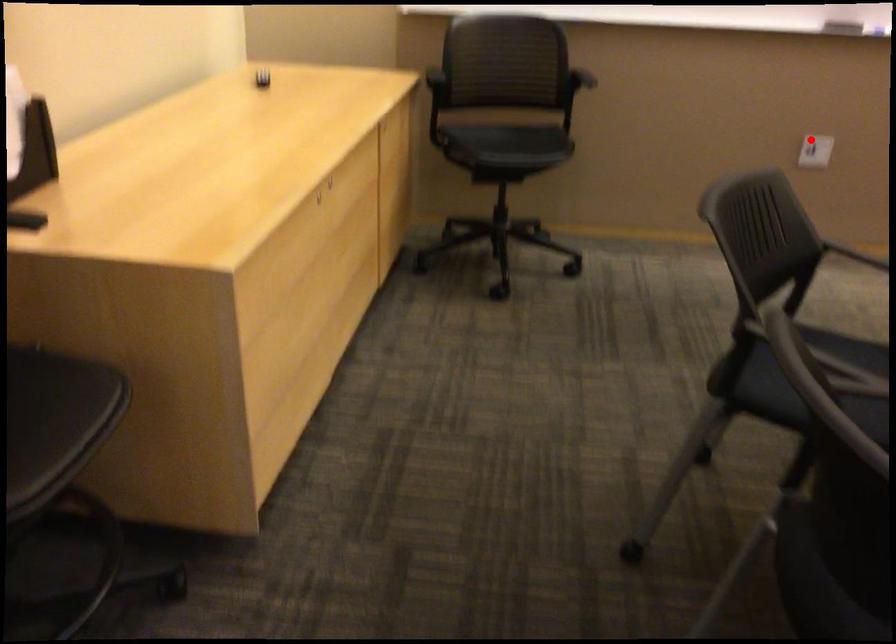
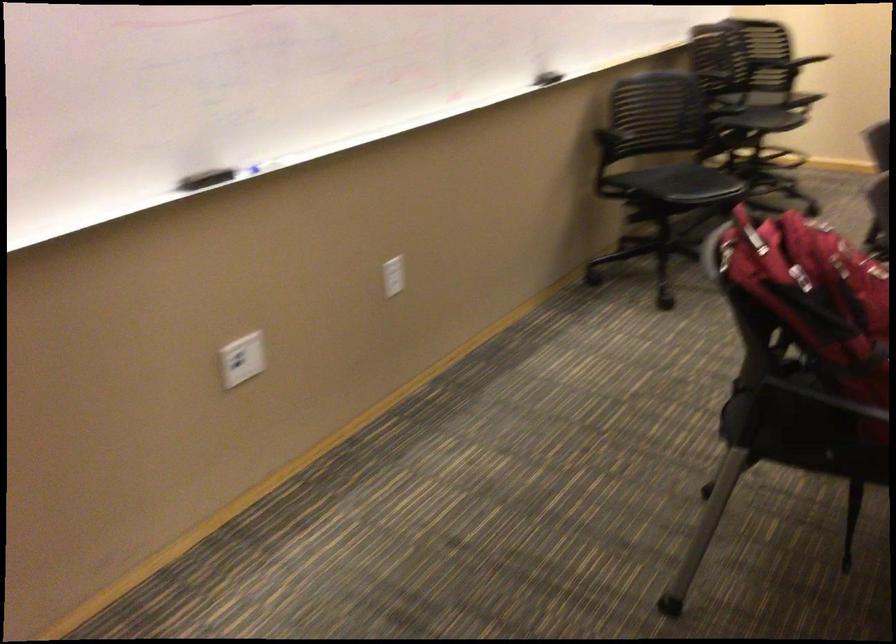
Question: I am providing you with two images of the same scene from different viewpoints. Image1 has a red point marked. In image2, the corresponding 3D location appears at what relative position? Reply with the corresponding letter.

Choices:
 (A) Closer
 (B) Farther

Answer: (A)